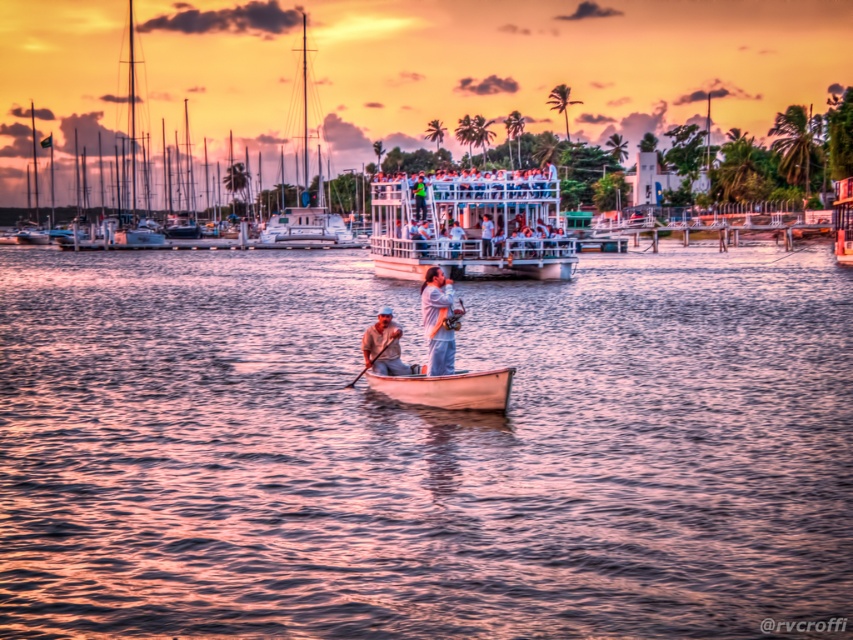
Identify the location of wooden canoe at center. (448, 388).

Which is above, wooden canoe at center or shiny white sailboat at center?

shiny white sailboat at center is above.

The width and height of the screenshot is (853, 640). What do you see at coordinates (448, 388) in the screenshot?
I see `wooden canoe at center` at bounding box center [448, 388].

At what (x,y) coordinates should I click in order to perform the action: click on wooden canoe at center. Please return your answer as a coordinate pair (x, y). The image size is (853, 640). Looking at the image, I should click on (448, 388).

Who is taller, white wooden boat at center or wooden canoe at center?

white wooden boat at center is taller.

Does white wooden boat at center lie in front of wooden canoe at center?

That is False.

Find the location of a particular element. This screenshot has width=853, height=640. white wooden boat at center is located at coordinates (347, 81).

Where is `white wooden boat at center`? white wooden boat at center is located at coordinates (347, 81).

Can you confirm if wooden canoe at center is thinner than light brown wooden oar at center?

No.

Is wooden canoe at center positioned behind light brown wooden oar at center?

No, it is not.

At what (x,y) coordinates should I click in order to perform the action: click on wooden canoe at center. Please return your answer as a coordinate pair (x, y). This screenshot has height=640, width=853. Looking at the image, I should click on pyautogui.click(x=448, y=388).

The image size is (853, 640). What are the coordinates of `wooden canoe at center` in the screenshot? It's located at (448, 388).